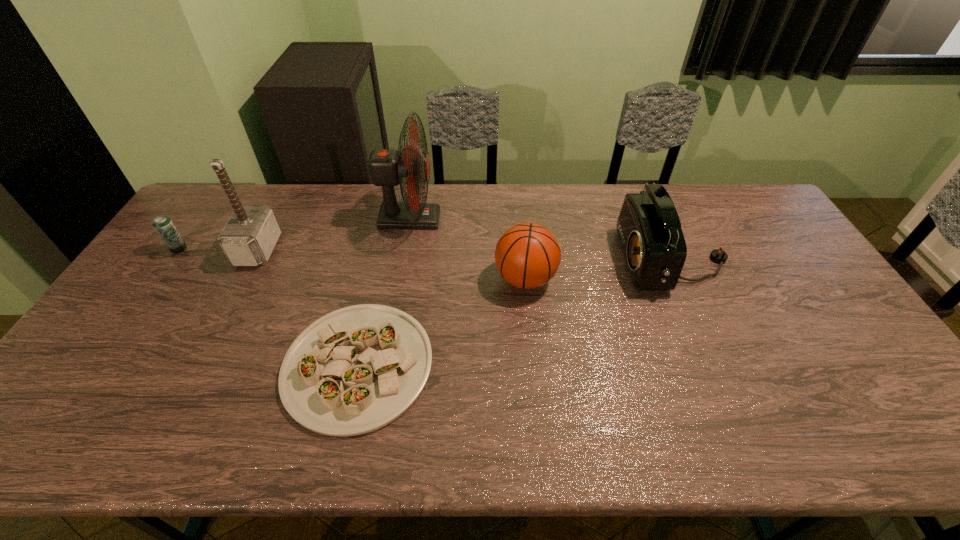
The width and height of the screenshot is (960, 540). I want to click on fan, so click(387, 167).

The width and height of the screenshot is (960, 540). Find the location of `the fifth object from right to left`. the fifth object from right to left is located at coordinates (250, 235).

This screenshot has height=540, width=960. In order to click on the third tallest object in this screenshot , I will do `click(649, 230)`.

This screenshot has height=540, width=960. In order to click on radio receiver in this screenshot , I will do `click(649, 230)`.

Find the location of a particular element. This screenshot has width=960, height=540. the fifth object from left to right is located at coordinates (527, 255).

Identify the location of basketball. The width and height of the screenshot is (960, 540). (527, 255).

I want to click on the second shortest object, so click(163, 225).

Locate an element on the screen. beer can is located at coordinates (163, 225).

Where is `the nearest object`? The height and width of the screenshot is (540, 960). the nearest object is located at coordinates pos(355,370).

Where is `the shortest object`? This screenshot has height=540, width=960. the shortest object is located at coordinates (355, 370).